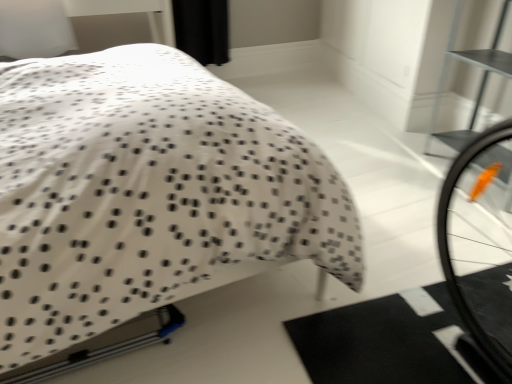
Question: Is white dotted fabric bed at center further to the viewer compared to metallic silver bookshelf at upper right?

Choices:
 (A) yes
 (B) no

Answer: (B)

Question: From a real-world perspective, is white dotted fabric bed at center on top of metallic silver bookshelf at upper right?

Choices:
 (A) no
 (B) yes

Answer: (B)

Question: Is white dotted fabric bed at center at the right side of metallic silver bookshelf at upper right?

Choices:
 (A) yes
 (B) no

Answer: (B)

Question: Does white dotted fabric bed at center have a larger size compared to metallic silver bookshelf at upper right?

Choices:
 (A) no
 (B) yes

Answer: (B)

Question: Considering the relative sizes of white dotted fabric bed at center and metallic silver bookshelf at upper right in the image provided, is white dotted fabric bed at center taller than metallic silver bookshelf at upper right?

Choices:
 (A) yes
 (B) no

Answer: (A)

Question: Could you tell me if white dotted fabric bed at center is facing metallic silver bookshelf at upper right?

Choices:
 (A) no
 (B) yes

Answer: (B)

Question: Can you confirm if metallic silver bookshelf at upper right is positioned to the right of white dotted fabric bed at center?

Choices:
 (A) yes
 (B) no

Answer: (A)

Question: Is white dotted fabric bed at center at the back of metallic silver bookshelf at upper right?

Choices:
 (A) yes
 (B) no

Answer: (B)

Question: From the image's perspective, is metallic silver bookshelf at upper right over white dotted fabric bed at center?

Choices:
 (A) yes
 (B) no

Answer: (A)

Question: From a real-world perspective, is metallic silver bookshelf at upper right physically above white dotted fabric bed at center?

Choices:
 (A) yes
 (B) no

Answer: (B)

Question: Is metallic silver bookshelf at upper right next to white dotted fabric bed at center and touching it?

Choices:
 (A) yes
 (B) no

Answer: (B)

Question: Is white dotted fabric bed at center completely or partially inside metallic silver bookshelf at upper right?

Choices:
 (A) no
 (B) yes

Answer: (A)

Question: In the image, is white dotted fabric bed at center positioned in front of or behind metallic silver bookshelf at upper right?

Choices:
 (A) front
 (B) behind

Answer: (A)